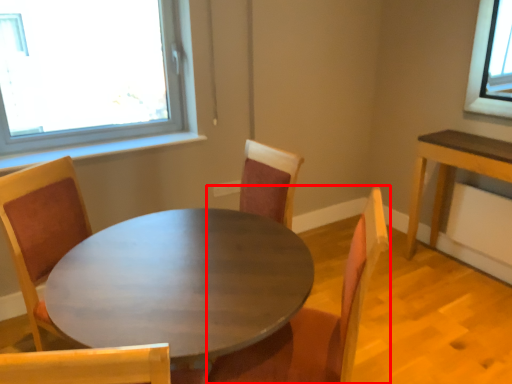
Question: From the image's perspective, what is the correct spatial positioning of chair (annotated by the red box) in reference to coffee table?

Choices:
 (A) above
 (B) below

Answer: (A)